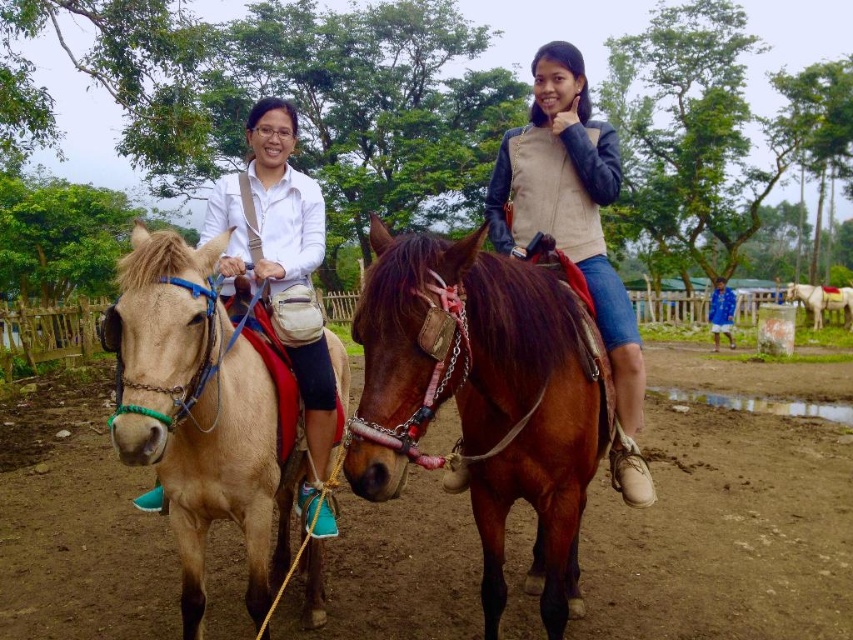
You are a photographer standing in the middle of the field. You want to take a photo of the light brown leather horse at left and the blue fabric jacket at lower right. Which object should you focus on first to ensure both are in focus?

You should focus on the light brown leather horse at left first since it is closer to the viewer than the blue fabric jacket at lower right. By focusing on the closer object, the farther one may still be in focus depending on the depth of field.

You are a photographer trying to capture a photo of the light brown leather horse at left and the blue fabric jacket at lower right. Based on their positions, which object should you focus on first if you want to ensure both are in the frame?

The light brown leather horse at left is below the blue fabric jacket at lower right, so you should focus on the blue fabric jacket at lower right first to ensure both are in the frame.

You are a photographer trying to capture a closeup of the matte beige vest at center while also including the brown soil at center in the shot. Based on their positions, which object should you focus on first to ensure both are in frame?

The brown soil at center is to the left of the matte beige vest at center. So, to include both in the frame, you should focus on the matte beige vest at center first as it is positioned to the right, allowing the brown soil at center to be captured on its left side within the same shot.